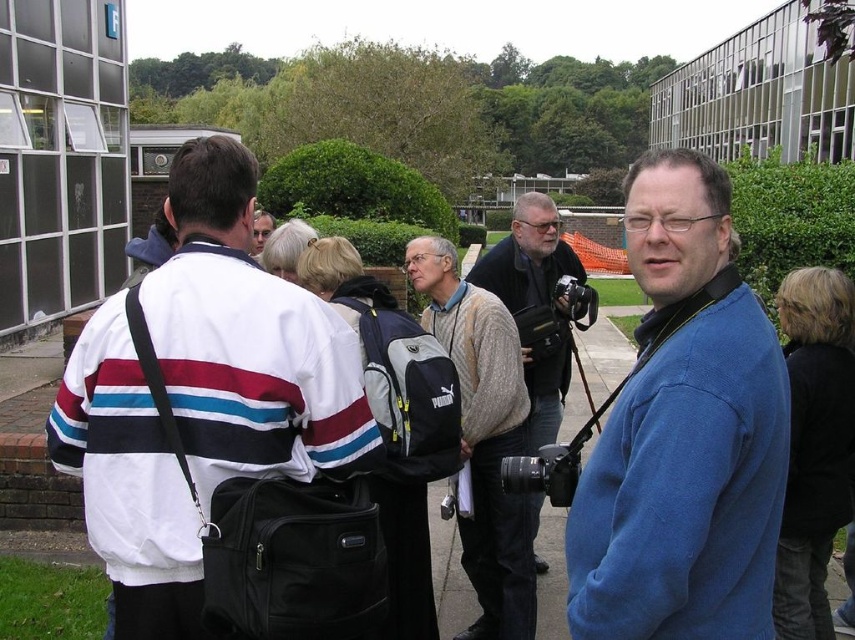
You are a photographer who needs to decide between using the matte black camera at center or the matte black backpack at center for a quick photo shoot. Which item is larger and more suitable for carrying multiple lenses?

The matte black camera at center is bigger than the matte black backpack at center, so it is larger and more suitable for carrying multiple lenses.

You are standing at the location of the man with the camera around his neck. You want to hand him your phone, which is in your pocket. The phone is 6 inches long. Can you reach the person wearing the white striped jacket at upper left without moving from your current position?

The distance between you and the white striped jacket at upper left is 6.64 feet, which is approximately 79.68 inches. Since your phone is only 6 inches long, you cannot reach them without moving closer.